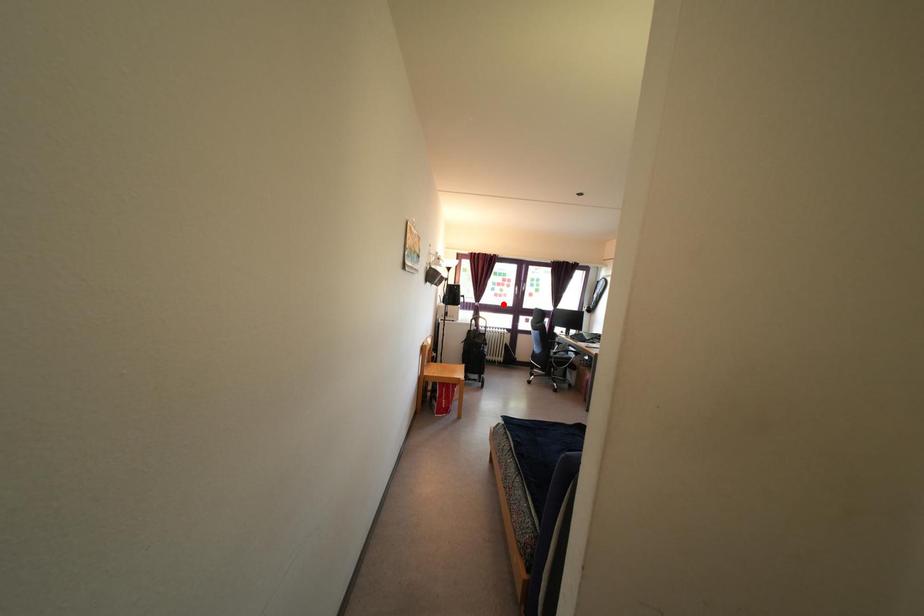
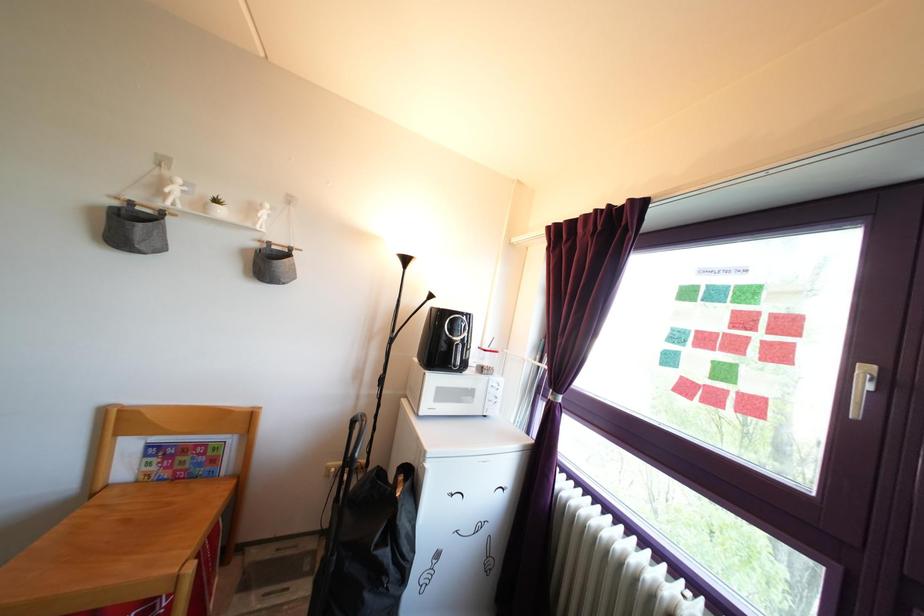
In the second image, find the point that corresponds to the highlighted location in the first image.

(715, 407)